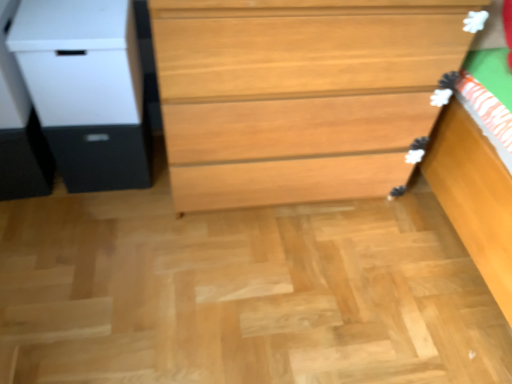
Question: Does light brown wood chest of drawers at center have a greater height compared to matte black drawer at left?

Choices:
 (A) yes
 (B) no

Answer: (A)

Question: Considering the relative sizes of light brown wood chest of drawers at center and matte black drawer at left in the image provided, is light brown wood chest of drawers at center smaller than matte black drawer at left?

Choices:
 (A) yes
 (B) no

Answer: (B)

Question: From a real-world perspective, is light brown wood chest of drawers at center positioned under matte black drawer at left based on gravity?

Choices:
 (A) yes
 (B) no

Answer: (B)

Question: Would you say light brown wood chest of drawers at center is a long distance from matte black drawer at left?

Choices:
 (A) yes
 (B) no

Answer: (B)

Question: From the image's perspective, is light brown wood chest of drawers at center beneath matte black drawer at left?

Choices:
 (A) no
 (B) yes

Answer: (A)

Question: Is white matte file cabinet at left to the left or to the right of light brown wood chest of drawers at center in the image?

Choices:
 (A) left
 (B) right

Answer: (A)

Question: From a real-world perspective, is white matte file cabinet at left physically located above or below light brown wood chest of drawers at center?

Choices:
 (A) below
 (B) above

Answer: (B)

Question: From their relative heights in the image, would you say white matte file cabinet at left is taller or shorter than light brown wood chest of drawers at center?

Choices:
 (A) tall
 (B) short

Answer: (B)

Question: Considering the positions of point (15, 54) and point (373, 105), is point (15, 54) closer or farther from the camera than point (373, 105)?

Choices:
 (A) closer
 (B) farther

Answer: (A)

Question: Do you think light brown wood chest of drawers at center is within white matte file cabinet at left, or outside of it?

Choices:
 (A) outside
 (B) inside

Answer: (A)

Question: In terms of height, does light brown wood chest of drawers at center look taller or shorter compared to white matte file cabinet at left?

Choices:
 (A) short
 (B) tall

Answer: (B)

Question: Based on their positions, is light brown wood chest of drawers at center located to the left or right of white matte file cabinet at left?

Choices:
 (A) left
 (B) right

Answer: (B)

Question: Considering the positions of point (274, 168) and point (80, 76), is point (274, 168) closer or farther from the camera than point (80, 76)?

Choices:
 (A) farther
 (B) closer

Answer: (A)

Question: From their relative heights in the image, would you say white matte file cabinet at left is taller or shorter than matte black drawer at left?

Choices:
 (A) short
 (B) tall

Answer: (B)

Question: In terms of size, does white matte file cabinet at left appear bigger or smaller than matte black drawer at left?

Choices:
 (A) big
 (B) small

Answer: (A)